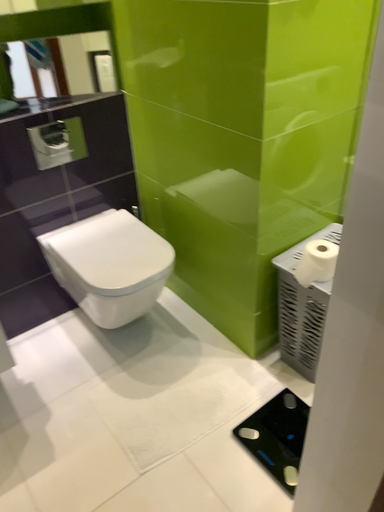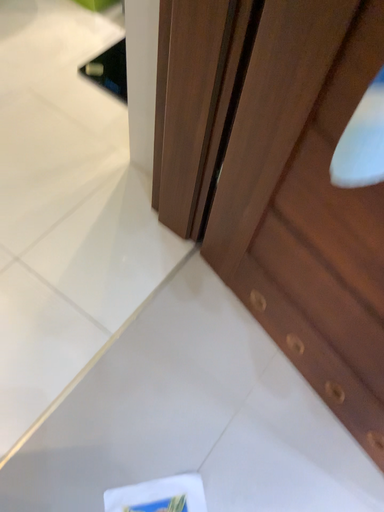
Question: Which way did the camera rotate in the video?

Choices:
 (A) rotated right
 (B) rotated left

Answer: (A)